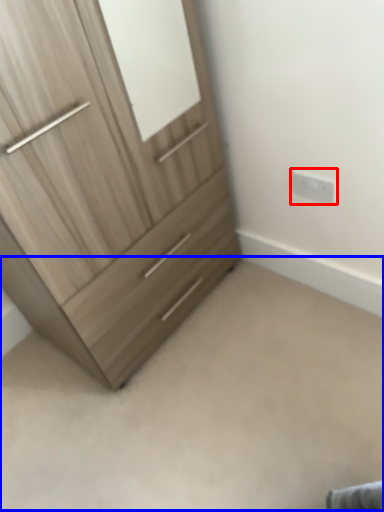
Question: Which point is closer to the camera, electric outlet (highlighted by a red box) or plain (highlighted by a blue box)?

Choices:
 (A) electric outlet
 (B) plain

Answer: (B)